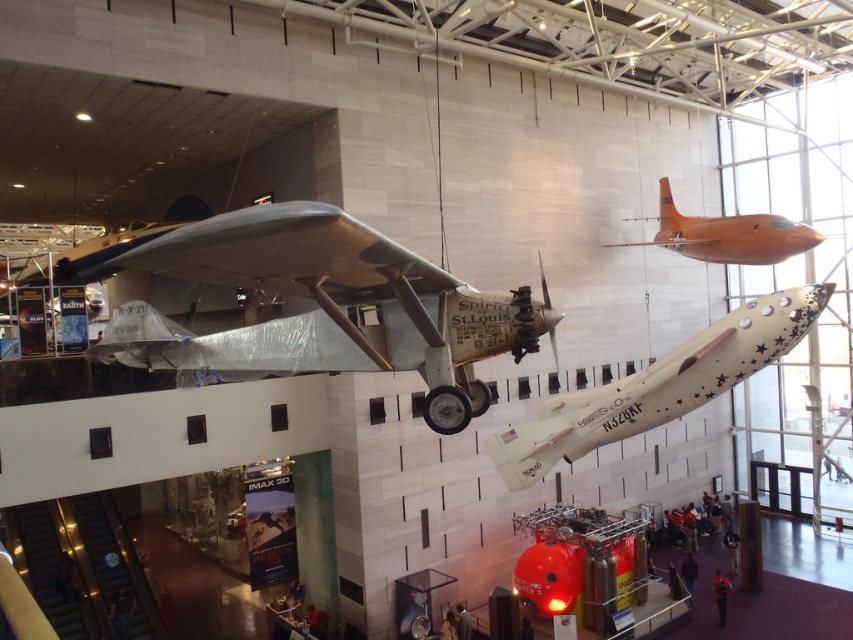
Is point (747, 371) positioned behind point (769, 252)?

No, it is in front of (769, 252).

Locate an element on the screen. The image size is (853, 640). white matte airplane at center is located at coordinates coord(659,385).

Where is `white matte airplane at center`? This screenshot has width=853, height=640. white matte airplane at center is located at coordinates (659, 385).

At what (x,y) coordinates should I click in order to perform the action: click on silver metallic airplane at center. Please return your answer as a coordinate pair (x, y). Looking at the image, I should click on (314, 301).

Where is `silver metallic airplane at center`? silver metallic airplane at center is located at coordinates (314, 301).

Is silver metallic airplane at center positioned behind white matte airplane at center?

No, silver metallic airplane at center is in front of white matte airplane at center.

Which is in front, point (218, 268) or point (547, 442)?

Point (218, 268) is in front.

The height and width of the screenshot is (640, 853). In order to click on silver metallic airplane at center in this screenshot , I will do tap(314, 301).